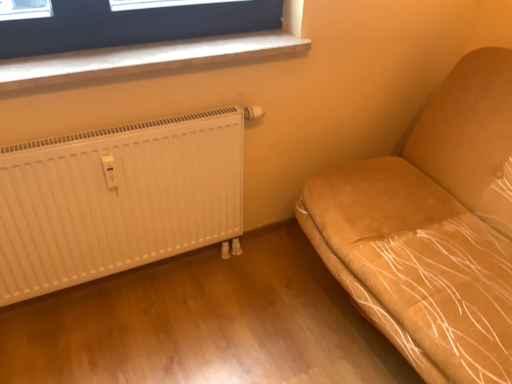
Locate an element on the screen. This screenshot has height=384, width=512. free location in front of white ribbed radiator at lower left is located at coordinates (129, 334).